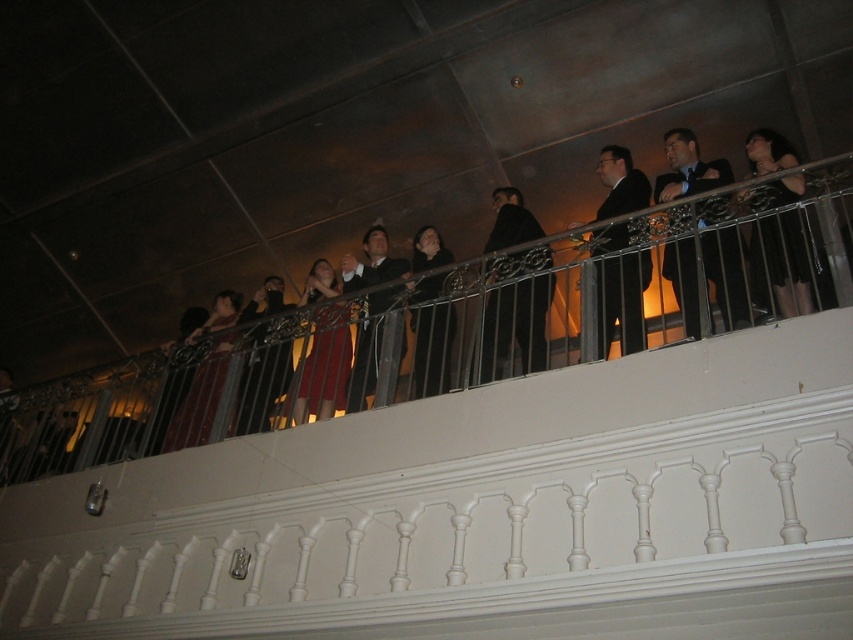
You are a photographer at the event and need to capture a clear photo of the matte black robe at center without the dark suit at upper right blocking it. How should you adjust your position?

Move your camera position below the matte black robe at center so that the dark suit at upper right is no longer above and blocking it.

Consider the image. You are a photographer at the event and want to capture both the dark brown leather jacket at center and the black satin dress at upper right in a single shot. Based on their positions, which one is closer to the camera?

The dark brown leather jacket at center is located below the black satin dress at upper right, meaning it is closer to the camera since it is positioned lower in the frame.